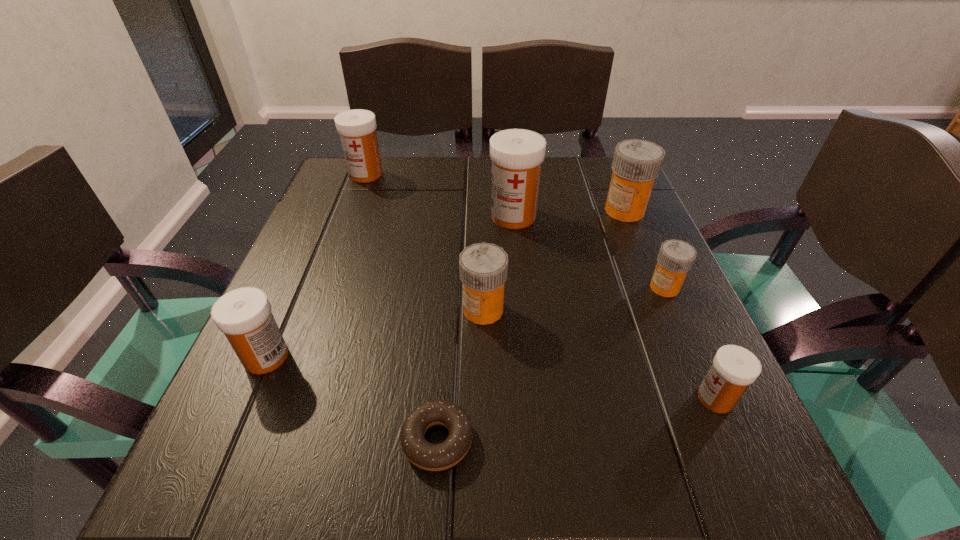
You are a GUI agent. You are given a task and a screenshot of the screen. Output one action in this format:
    pyautogui.click(x=<x>, y=<y>)
    Task: Click on the second white medicine from right to left
    This screenshot has width=960, height=540.
    Given the screenshot: What is the action you would take?
    pyautogui.click(x=517, y=154)

Find the location of a particular element. This screenshot has width=960, height=540. the biggest white medicine is located at coordinates (517, 154).

Locate an element on the screen. the third smallest white medicine is located at coordinates (357, 128).

The image size is (960, 540). What are the coordinates of `the farthest white medicine` in the screenshot? It's located at (357, 128).

The height and width of the screenshot is (540, 960). I want to click on the farthest orange medicine, so click(636, 163).

Locate an element on the screen. This screenshot has height=540, width=960. the leftmost orange medicine is located at coordinates (483, 267).

Locate an element on the screen. the third biggest white medicine is located at coordinates (244, 315).

The height and width of the screenshot is (540, 960). Identify the location of the second nearest medicine. (244, 315).

The width and height of the screenshot is (960, 540). I want to click on the smallest orange medicine, so click(676, 257).

Find the location of a particular element. This screenshot has width=960, height=540. the nearest medicine is located at coordinates (734, 368).